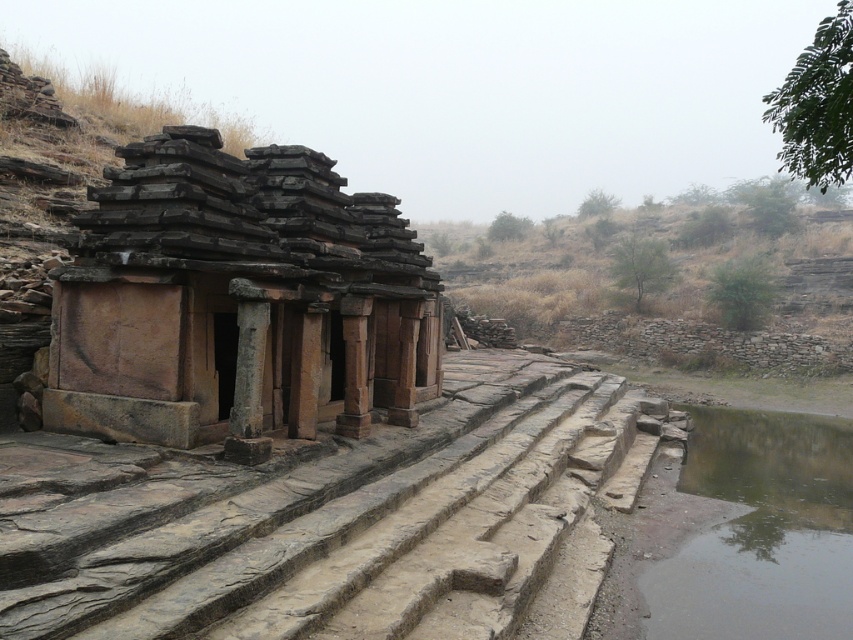
Looking at this image, you are an archaeologist examining the ancient stone structure. You notice two features at the center of the image. One is the rustic stone stairs at center and the other is the rustic stone ruins at center. Which of these two features is taller?

The rustic stone stairs at center is taller than the rustic stone ruins at center.

In the scene shown: You are standing at the base of the ancient stone structure and want to reach the point marked at coordinates point (248,445). If your walking speed is 3 feet per second, how long will it take you to reach that point?

The distance between you and the point (248,445) is 26.21 feet. At a speed of 3 feet per second, it will take approximately 8.74 seconds to reach the point.

You are a tourist standing at the top of the rustic stone stairs at center. You want to reach the greenish murky water at bottom right. Based on the scene, which direction should you move to get there?

The rustic stone stairs at center is in front of the greenish murky water at bottom right, so you should move forward towards the greenish murky water at bottom right to reach it.